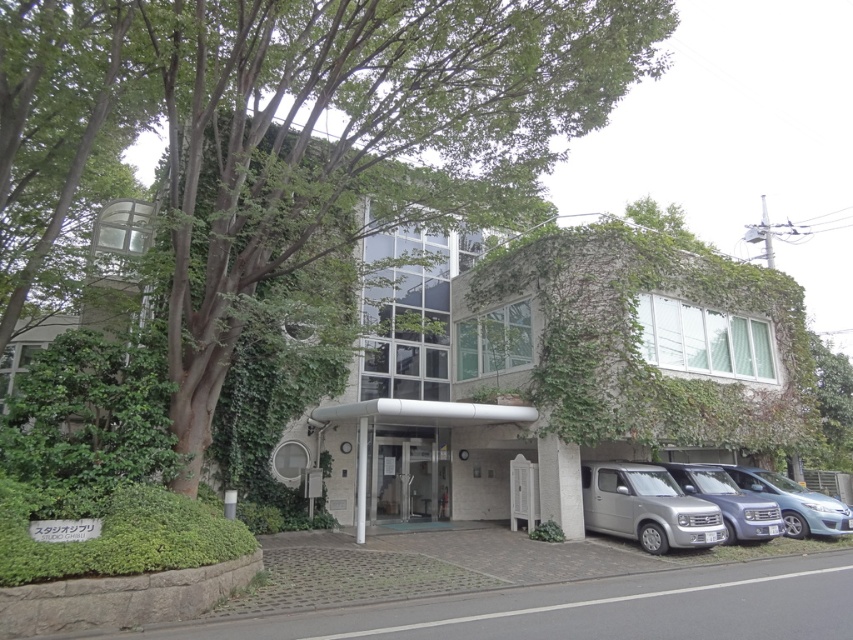
You are a delivery driver approaching the building and need to park your vehicle. The parking spot you want is near the entrance. Considering the green leafy tree at center and the silver metallic van at lower right, which object might block your view of the entrance when parking?

The green leafy tree at center is much taller than the silver metallic van at lower right, so it might block your view of the entrance when parking.

You are a delivery driver approaching the building and need to park your vehicle. You see a silver metallic van at lower right and a satin blue van at lower right. Which van is parked closer to the entrance?

The silver metallic van at lower right is located above the satin blue van at lower right, meaning it is closer to the entrance.